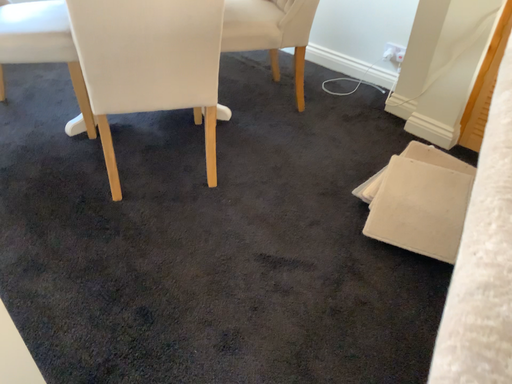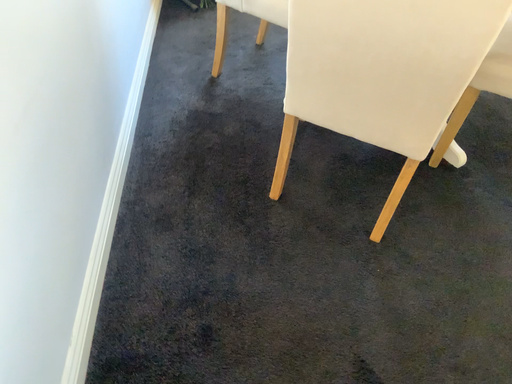
Question: How did the camera likely rotate when shooting the video?

Choices:
 (A) rotated left
 (B) rotated right

Answer: (A)